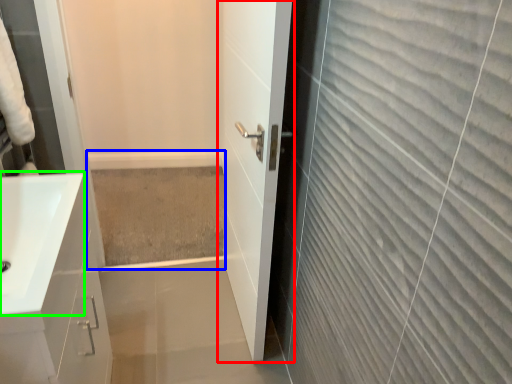
Question: Which object is positioned closest to door (highlighted by a red box)? Select from bath (highlighted by a blue box) and sink (highlighted by a green box).

Choices:
 (A) bath
 (B) sink

Answer: (B)